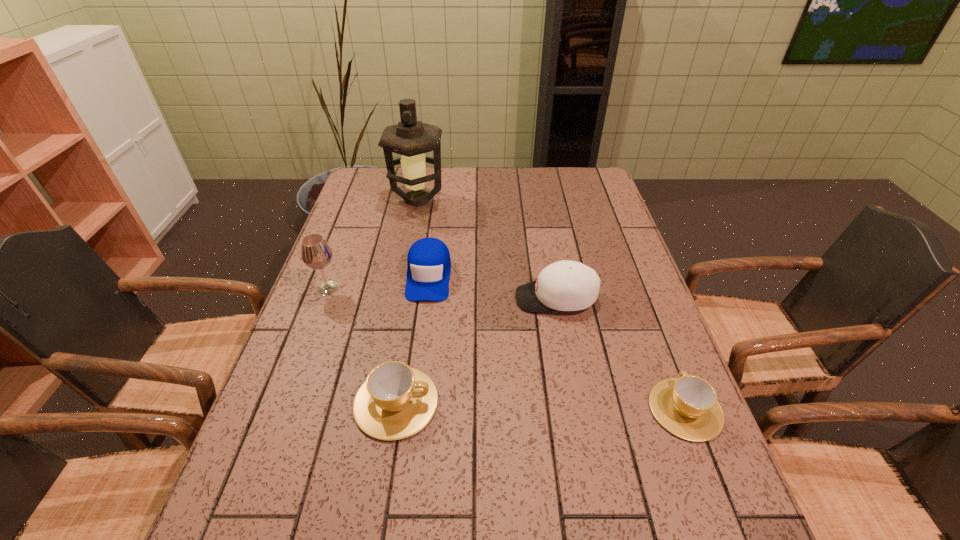
If the aim is uniform spacing by inserting an additional cup among them, please point to a vacant space for this new cup. Please provide its 2D coordinates. Your answer should be formatted as a tuple, i.e. [(x, y)], where the tuple contains the x and y coordinates of a point satisfying the conditions above.

[(540, 406)]